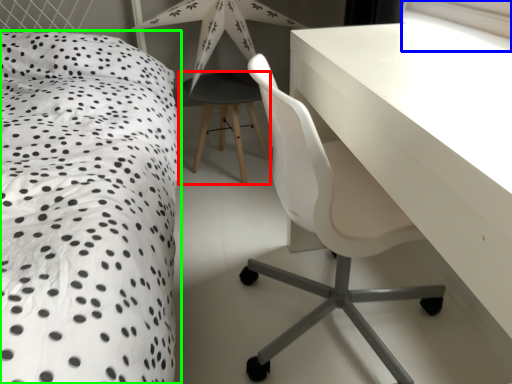
Question: Which is farther away from bar stool (highlighted by a red box)? window screen (highlighted by a blue box) or bed (highlighted by a green box)?

Choices:
 (A) window screen
 (B) bed

Answer: (A)